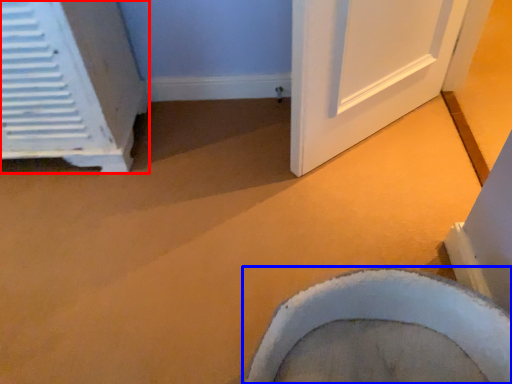
Question: Among these objects, which one is nearest to the camera, air conditioning (highlighted by a red box) or toilet (highlighted by a blue box)?

Choices:
 (A) air conditioning
 (B) toilet

Answer: (B)